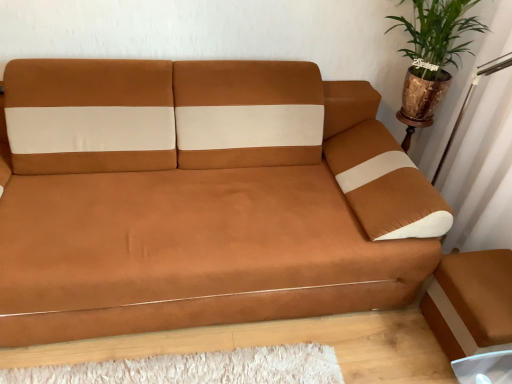
Question: Is green leafy plant in metallic pot at upper right wider than brown leather couch at center?

Choices:
 (A) yes
 (B) no

Answer: (B)

Question: Does green leafy plant in metallic pot at upper right have a lesser width compared to brown leather couch at center?

Choices:
 (A) no
 (B) yes

Answer: (B)

Question: Is green leafy plant in metallic pot at upper right positioned in front of brown leather couch at center?

Choices:
 (A) no
 (B) yes

Answer: (A)

Question: Does green leafy plant in metallic pot at upper right have a larger size compared to brown leather couch at center?

Choices:
 (A) no
 (B) yes

Answer: (A)

Question: Considering the relative sizes of green leafy plant in metallic pot at upper right and brown leather couch at center in the image provided, is green leafy plant in metallic pot at upper right smaller than brown leather couch at center?

Choices:
 (A) yes
 (B) no

Answer: (A)

Question: Considering the relative sizes of green leafy plant in metallic pot at upper right and brown leather couch at center in the image provided, is green leafy plant in metallic pot at upper right shorter than brown leather couch at center?

Choices:
 (A) no
 (B) yes

Answer: (B)

Question: From the image's perspective, is brown leather couch at center located above green leafy plant in metallic pot at upper right?

Choices:
 (A) yes
 (B) no

Answer: (B)

Question: From a real-world perspective, is brown leather couch at center on top of green leafy plant in metallic pot at upper right?

Choices:
 (A) yes
 (B) no

Answer: (B)

Question: Considering the relative sizes of brown leather couch at center and green leafy plant in metallic pot at upper right in the image provided, is brown leather couch at center bigger than green leafy plant in metallic pot at upper right?

Choices:
 (A) yes
 (B) no

Answer: (A)

Question: Does brown leather couch at center have a greater width compared to green leafy plant in metallic pot at upper right?

Choices:
 (A) yes
 (B) no

Answer: (A)

Question: From the image's perspective, is brown leather couch at center below green leafy plant in metallic pot at upper right?

Choices:
 (A) yes
 (B) no

Answer: (A)

Question: Would you say brown leather couch at center contains green leafy plant in metallic pot at upper right?

Choices:
 (A) yes
 (B) no

Answer: (B)

Question: Looking at their shapes, would you say green leafy plant in metallic pot at upper right is wider or thinner than brown leather couch at center?

Choices:
 (A) thin
 (B) wide

Answer: (A)